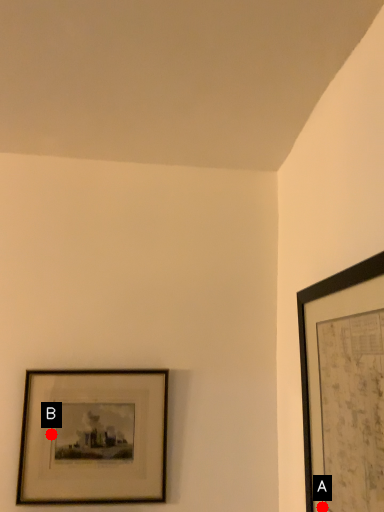
Question: Two points are circled on the image, labeled by A and B beside each circle. Which point is farther from the camera taking this photo?

Choices:
 (A) A is further
 (B) B is further

Answer: (B)